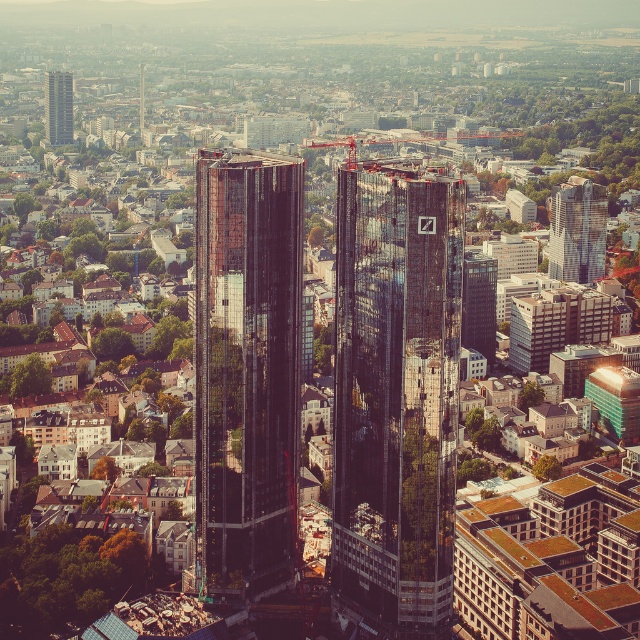
Which is below, reflective glass skyscraper at upper right or metallic red crane at center?

reflective glass skyscraper at upper right

At what (x,y) coordinates should I click in order to perform the action: click on reflective glass skyscraper at upper right. Please return your answer as a coordinate pair (x, y). This screenshot has width=640, height=640. Looking at the image, I should click on (577, 230).

The image size is (640, 640). I want to click on reflective glass skyscraper at upper right, so click(577, 230).

Does glossy glass tower at center appear on the left side of metallic red crane at center?

Correct, you'll find glossy glass tower at center to the left of metallic red crane at center.

Between glossy glass tower at center and metallic red crane at center, which one is positioned higher?

metallic red crane at center is higher up.

Does point (202, 582) come behind point (307, 141)?

No.

Image resolution: width=640 pixels, height=640 pixels. What are the coordinates of `glossy glass tower at center` in the screenshot? It's located at (246, 372).

Is reflective glass skyscraper at upper right further to the viewer compared to glassy reflective skyscraper at upper left?

That is False.

Is reflective glass skyscraper at upper right smaller than glassy reflective skyscraper at upper left?

Actually, reflective glass skyscraper at upper right might be larger than glassy reflective skyscraper at upper left.

Where is `reflective glass skyscraper at upper right`? The image size is (640, 640). reflective glass skyscraper at upper right is located at coordinates (577, 230).